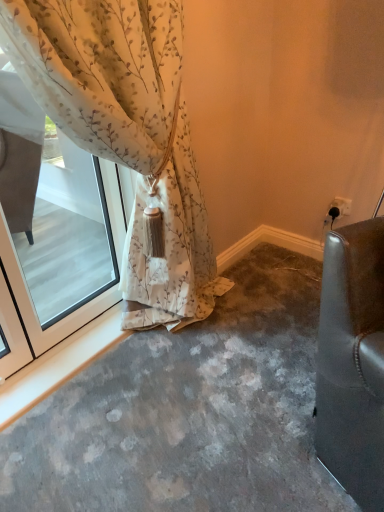
The width and height of the screenshot is (384, 512). Describe the element at coordinates (126, 132) in the screenshot. I see `floral sheer curtain at left` at that location.

What is the approximate height of floral sheer curtain at left?

The height of floral sheer curtain at left is 1.31 meters.

This screenshot has width=384, height=512. Identify the location of floral sheer curtain at left. (126, 132).

Find the location of a particular element. The image size is (384, 512). floral sheer curtain at left is located at coordinates (126, 132).